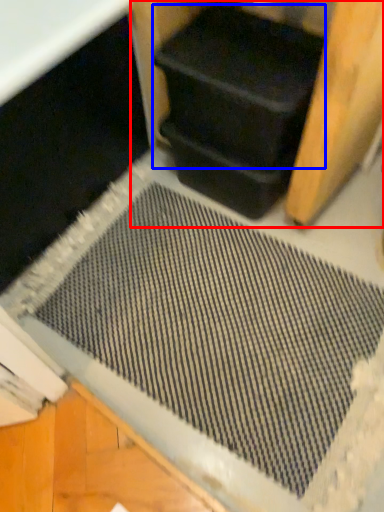
Question: Which point is closer to the camera, wood (highlighted by a red box) or wide (highlighted by a blue box)?

Choices:
 (A) wood
 (B) wide

Answer: (A)